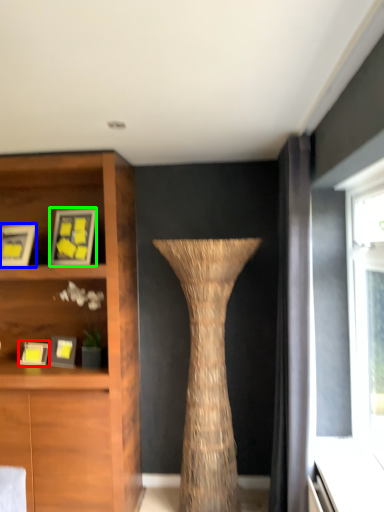
Question: Which object is positioned farthest from picture frame (highlighted by a red box)? Select from picture frame (highlighted by a blue box) and picture frame (highlighted by a green box).

Choices:
 (A) picture frame
 (B) picture frame

Answer: (B)